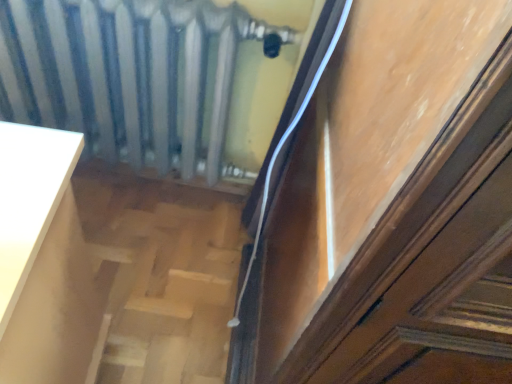
What is the approximate height of metallic radiator at upper left?

metallic radiator at upper left is 23.83 inches in height.

Image resolution: width=512 pixels, height=384 pixels. I want to click on metallic radiator at upper left, so click(x=136, y=78).

The width and height of the screenshot is (512, 384). What do you see at coordinates (136, 78) in the screenshot?
I see `metallic radiator at upper left` at bounding box center [136, 78].

I want to click on metallic radiator at upper left, so click(x=136, y=78).